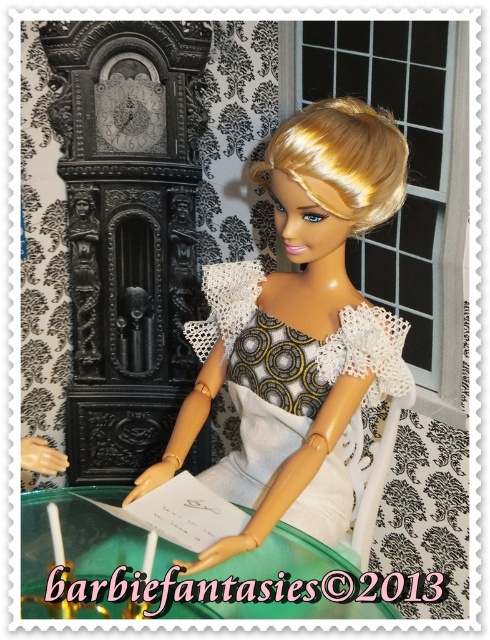
What is located at the coordinates point (297, 330) in the image?

The matte white dress at center is located at point (297, 330).

You are a tailor trying to decide which dress to display in a showcase. The showcase has a height limit of 1 meter. Given that the matte white dress at center is much taller than the patterned fabric dress at center, which dress would you choose to fit within the showcase height?

The patterned fabric dress at center is shorter than the matte white dress at center, so the patterned fabric dress at center would fit within the showcase height limit of 1 meter.

You are a dress designer observing the doll in the image. You need to determine which dress has a wider silhouette between the matte white dress at center and the patterned fabric dress at center. Which one is wider?

The matte white dress at center is wider than the patterned fabric dress at center according to the description.